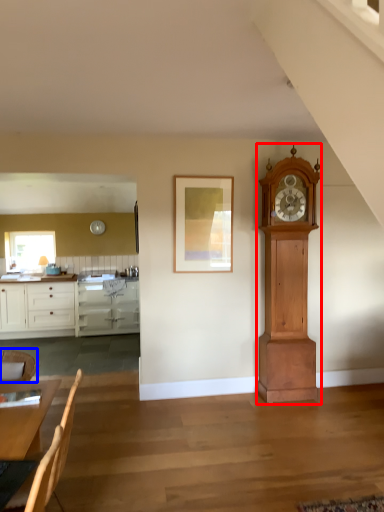
Question: Which point is closer to the camera, wall clock (highlighted by a red box) or chair (highlighted by a blue box)?

Choices:
 (A) wall clock
 (B) chair

Answer: (B)